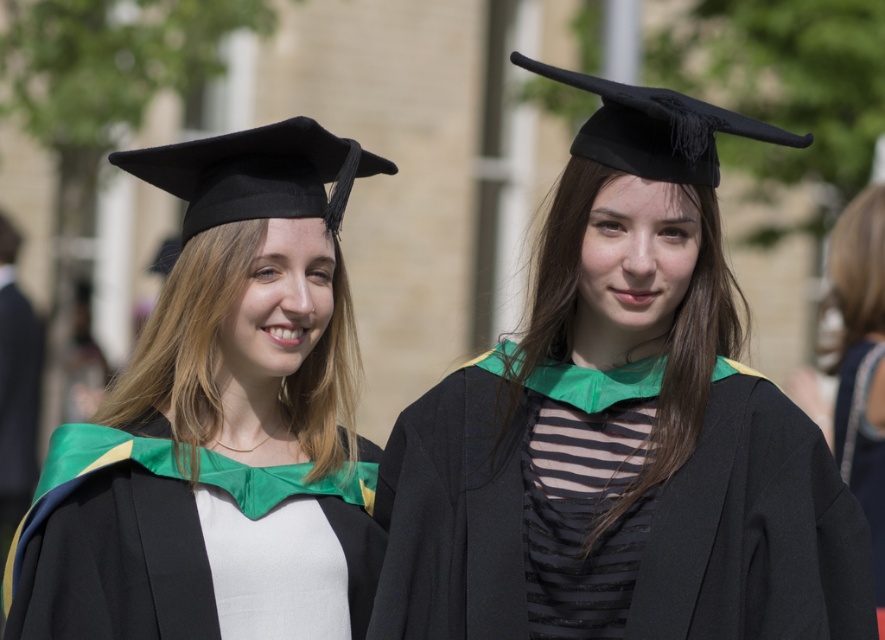
Does black matte graduation cap at left appear over black satin graduation gown at right?

Correct, black matte graduation cap at left is located above black satin graduation gown at right.

Can you confirm if black matte graduation cap at left is positioned below black satin graduation gown at right?

No.

This screenshot has width=885, height=640. Identify the location of black matte graduation cap at left. (256, 173).

You are a GUI agent. You are given a task and a screenshot of the screen. Output one action in this format:
    pyautogui.click(x=<x>, y=<y>)
    Task: Click on the black matte graduation cap at left
    Image resolution: width=885 pixels, height=640 pixels.
    Given the screenshot: What is the action you would take?
    pyautogui.click(x=256, y=173)

Measure the distance from satin black graduation cap at left to black matte graduation cap at left.

satin black graduation cap at left and black matte graduation cap at left are 31.51 centimeters apart from each other.

Which is above, satin black graduation cap at left or black matte graduation cap at left?

black matte graduation cap at left

Who is more forward, (227, 490) or (336, 172)?

Point (227, 490)

This screenshot has width=885, height=640. I want to click on satin black graduation cap at left, so click(221, 422).

Does point (343, 499) come farther from viewer compared to point (88, 630)?

Yes, point (343, 499) is behind point (88, 630).

Does satin black graduation cap at left have a smaller size compared to satin green graduation gown at center?

Incorrect, satin black graduation cap at left is not smaller in size than satin green graduation gown at center.

Which is in front, point (237, 522) or point (14, 634)?

Point (14, 634)

Locate an element on the screen. Image resolution: width=885 pixels, height=640 pixels. satin black graduation cap at left is located at coordinates (221, 422).